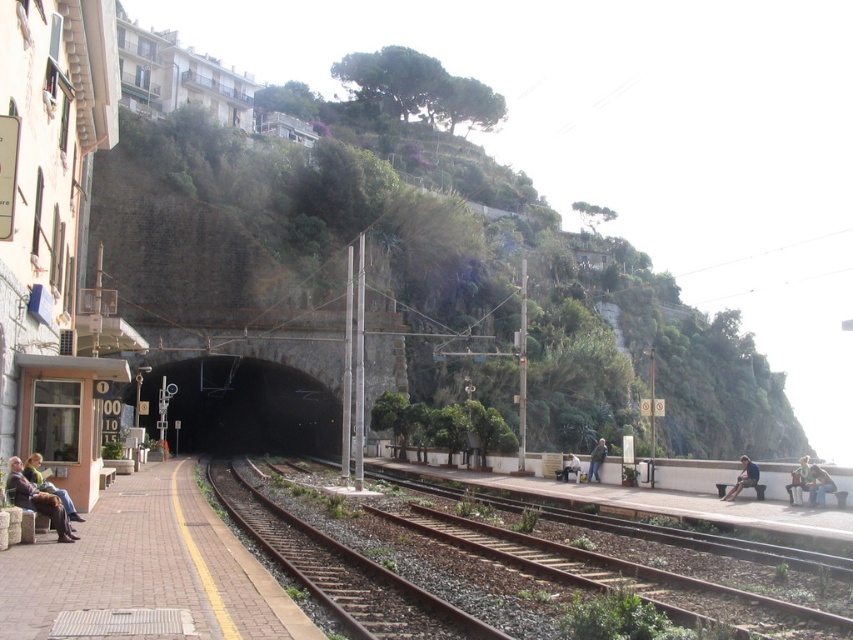
Can you confirm if light brown wooden bench at right is thinner than dark gray jacket at center?

No, light brown wooden bench at right is not thinner than dark gray jacket at center.

Is light brown wooden bench at right wider than dark gray jacket at center?

Answer: Indeed, light brown wooden bench at right has a greater width compared to dark gray jacket at center.

Identify the location of light brown wooden bench at right. This screenshot has width=853, height=640. (743, 477).

Does rusty metal train track at center lie behind blue denim jeans at lower right?

That is False.

Is rusty metal train track at center below blue denim jeans at lower right?

No, rusty metal train track at center is not below blue denim jeans at lower right.

Who is more forward, (305, 550) or (801, 464)?

Point (305, 550)

This screenshot has width=853, height=640. I want to click on rusty metal train track at center, so click(341, 572).

Is point (160, 138) positioned after point (235, 465)?

That is True.

Is green leafy hillside at center closer to camera compared to rusty metal tracks at center?

That is False.

Who is more distant from viewer, (149, 216) or (625, 579)?

Positioned behind is point (149, 216).

This screenshot has height=640, width=853. What are the coordinates of `green leafy hillside at center` in the screenshot? It's located at (282, 230).